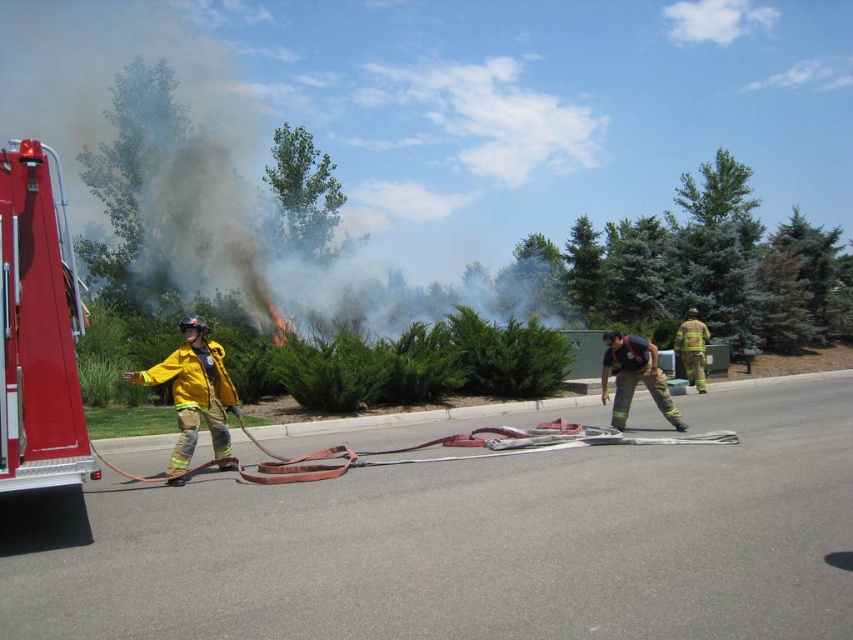
You are a firefighter trainee observing the scene. You notice the reflective silver helmet at center and the yellow reflective uniform at center. Which object is closer to you, the observer?

The reflective silver helmet at center is closer to you because it is in front of the yellow reflective uniform at center.

You are a firefighter observing the training exercise. You notice the smoketransparent at upper center and the yellow reflective uniform at center. Which object is higher in the scene?

The smoketransparent at upper center is much taller than the yellow reflective uniform at center, so the smoketransparent at upper center is higher in the scene.

You are a drone operator trying to capture aerial footage of the fire training exercise. You need to ensure that both points, point [68,288] and point [677,340], are visible in your shot. Which point will appear closer to the bottom edge of the frame?

Point [68,288] is closer to the camera than point [677,340], so it will appear closer to the bottom edge of the frame.